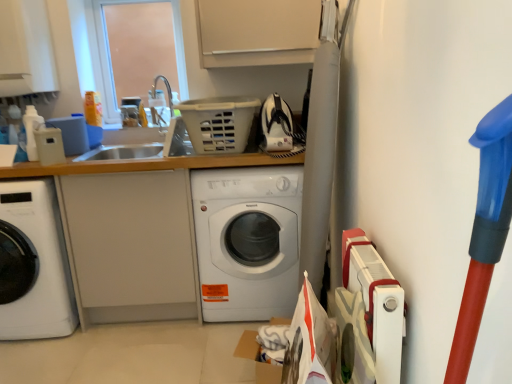
Question: From a real-world perspective, is white glossy washing machine at center, marked as the 1th washing machine in a right-to-left arrangement, above or below white matte counter top at center?

Choices:
 (A) below
 (B) above

Answer: (A)

Question: From their relative heights in the image, would you say white glossy washing machine at center, marked as the 1th washing machine in a right-to-left arrangement, is taller or shorter than white matte counter top at center?

Choices:
 (A) tall
 (B) short

Answer: (B)

Question: Which object is the closest to the white matte counter top at center?

Choices:
 (A) white glossy washing machine at center, which ranks as the 2th washing machine in left-to-right order
 (B) transparent plastic window screen at upper left
 (C) white glossy washing machine at left, which appears as the first washing machine when viewed from the left

Answer: (A)

Question: Which of these objects is positioned farthest from the white matte counter top at center?

Choices:
 (A) white glossy washing machine at left, acting as the second washing machine starting from the right
 (B) transparent plastic window screen at upper left
 (C) white glossy washing machine at center, marked as the 1th washing machine in a right-to-left arrangement

Answer: (B)